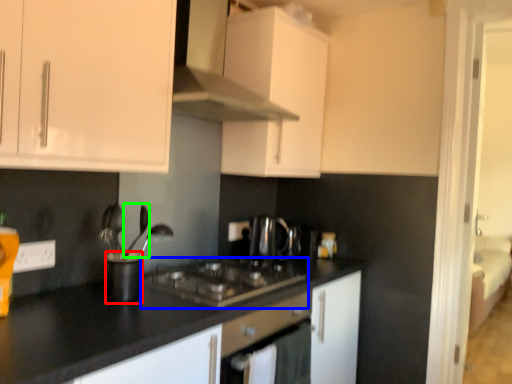
Question: Which is farther away from appliance (highlighted by a red box)? gas stove (highlighted by a blue box) or silverware (highlighted by a green box)?

Choices:
 (A) gas stove
 (B) silverware

Answer: (A)